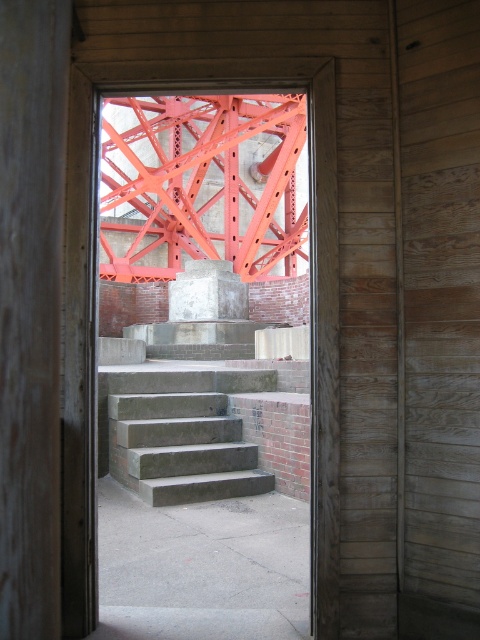
You are standing at the doorway and see two points marked on the concrete steps leading to the red steel truss. The points are labeled as point 1 at coordinates [228,179] and point 2 at [192,312]. Which point is closer to you as you stand at the doorway?

Point 1 at coordinates [228,179] is closer to you because it is further to the viewer than point 2 at [192,312].

You are standing at the doorway and want to take a photo of the bright orange steel structure at center. If your camera can focus on objects up to 10 feet away, will you be able to capture it clearly?

The bright orange steel structure at center and camera are 11.60 feet apart, which is beyond the camera focus range of 10 feet. Therefore, you won the camera cannot focus on the bright orange steel structure at center clearly.

You are standing at the doorway and want to know which part is higher between the concrete stairs at center and the concrete at center. Which one is higher?

The concrete stairs at center is taller than the concrete at center, so the concrete stairs at center is higher.